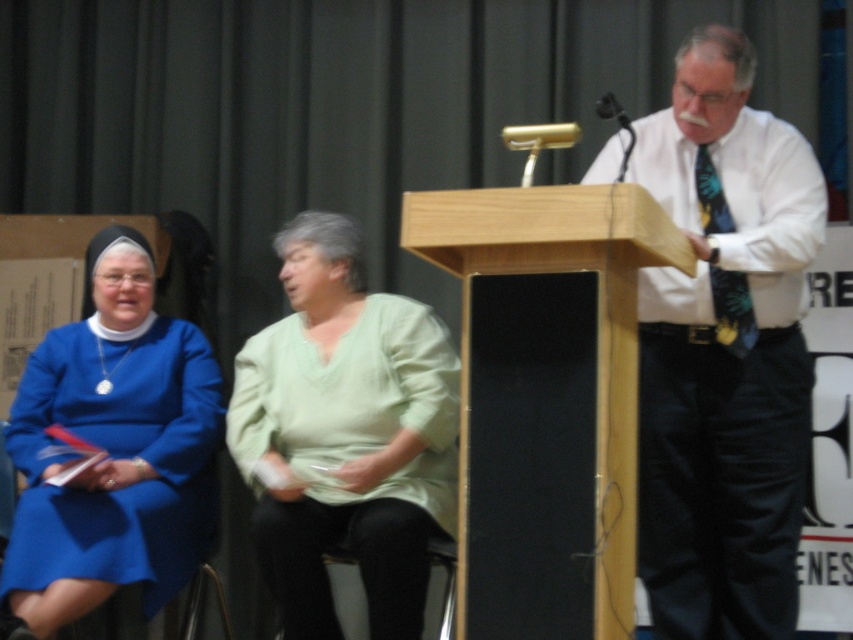
Question: Is white shirt at center thinner than floral silk tie at right?

Choices:
 (A) yes
 (B) no

Answer: (B)

Question: Which object appears closest to the camera in this image?

Choices:
 (A) green cotton shirt at center
 (B) floral silk tie at right
 (C) blue fabric dress at left

Answer: (B)

Question: Which is nearer to the floral silk tie at right?

Choices:
 (A) green cotton shirt at center
 (B) white shirt at center
 (C) blue fabric dress at left

Answer: (B)

Question: Does white shirt at center have a greater width compared to blue fabric dress at left?

Choices:
 (A) no
 (B) yes

Answer: (A)

Question: Estimate the real-world distances between objects in this image. Which object is farther from the blue fabric dress at left?

Choices:
 (A) floral silk tie at right
 (B) green cotton shirt at center

Answer: (A)

Question: Is the position of white shirt at center less distant than that of floral silk tie at right?

Choices:
 (A) yes
 (B) no

Answer: (A)